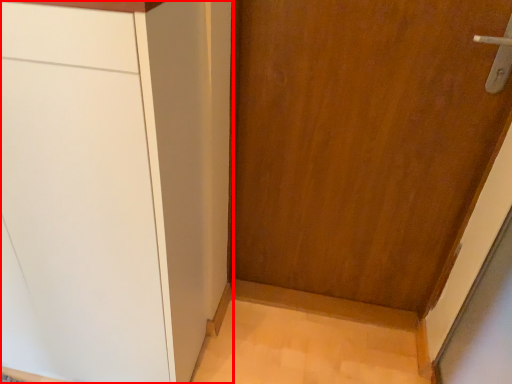
Question: Considering the relative positions of cabinetry (annotated by the red box) and door in the image provided, where is cabinetry (annotated by the red box) located with respect to the staircase?

Choices:
 (A) left
 (B) right

Answer: (A)